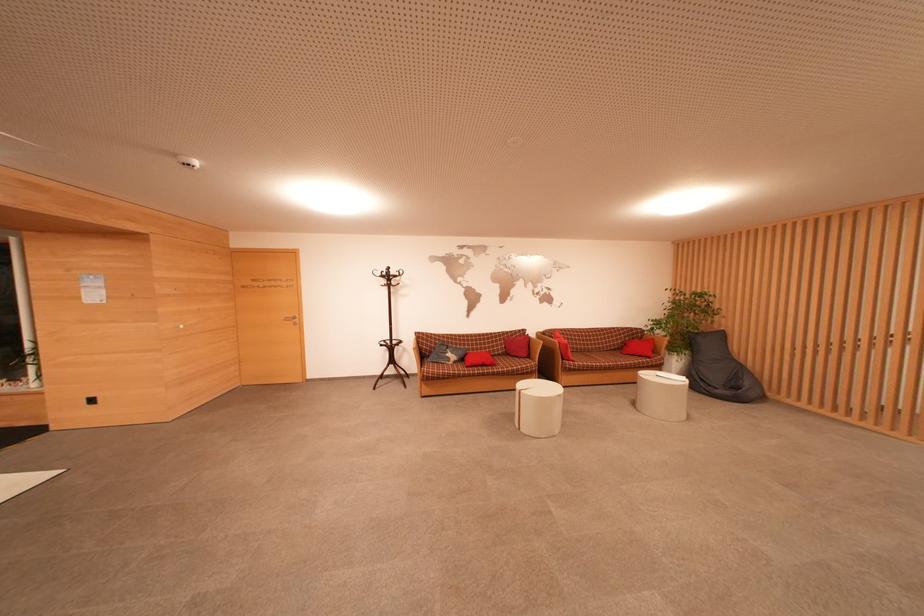
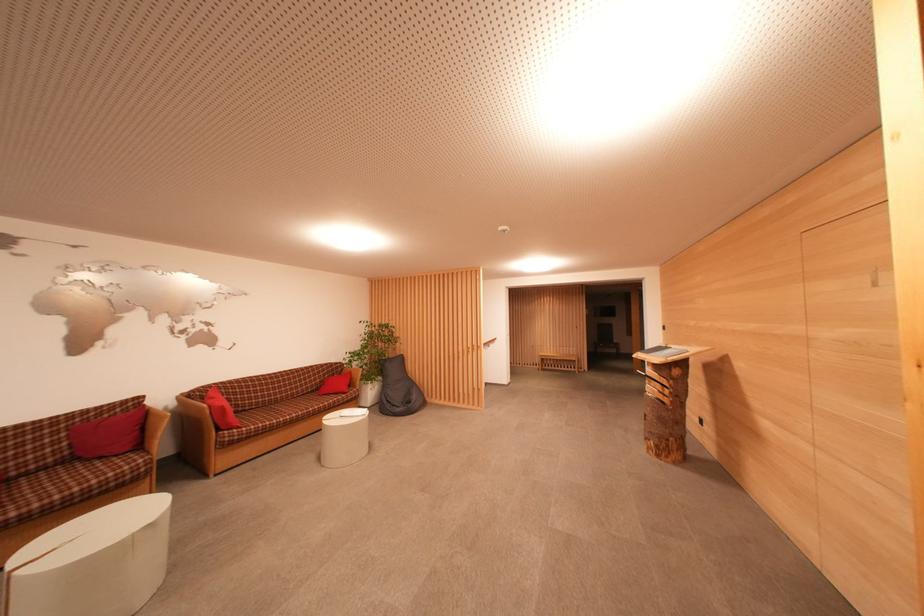
The point at (602, 354) is marked in the first image. Where is the corresponding point in the second image?

(296, 400)